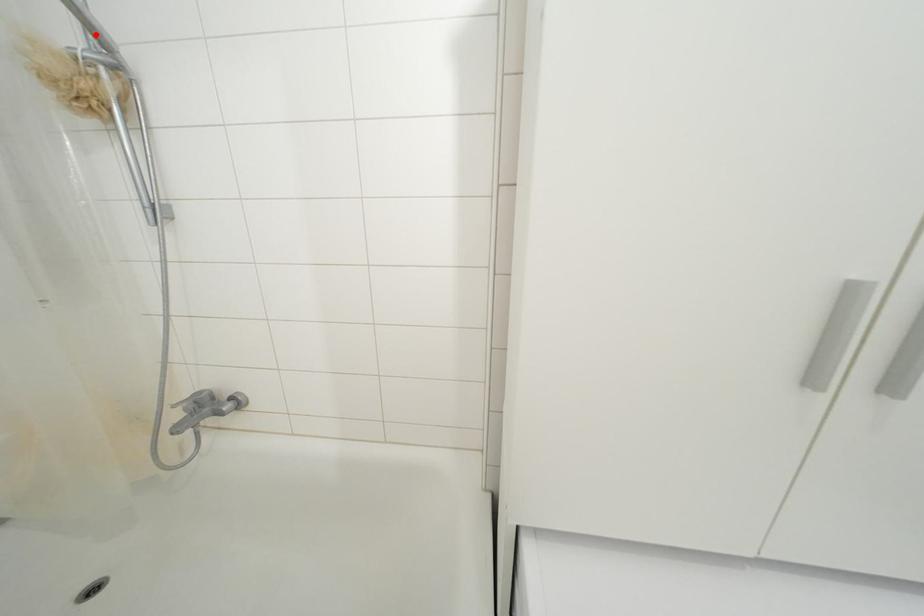
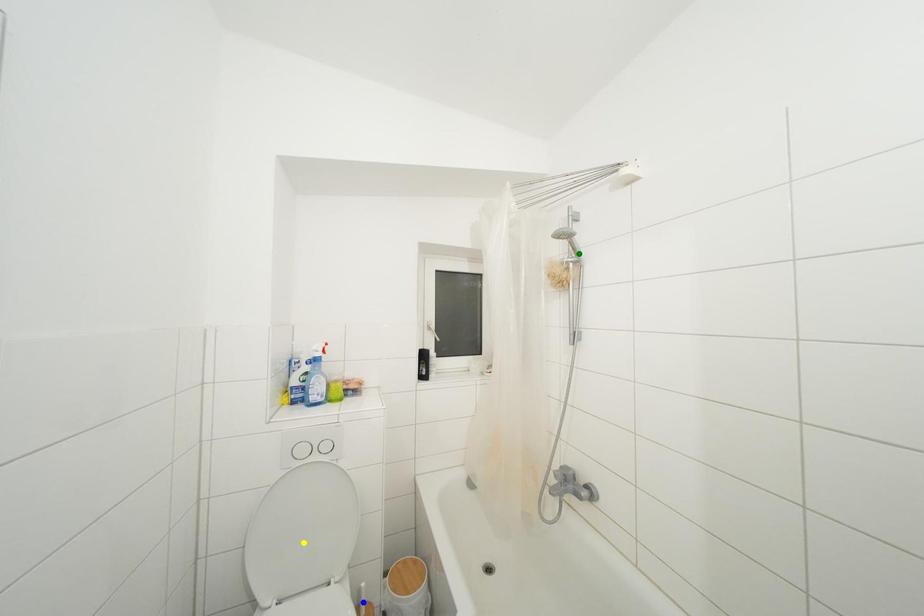
Question: I am providing you with two images of the same scene from different viewpoints. A red point is marked on the first image. You are given multiple points on the second image. Which spot in image 2 lines up with the point in image 1?

Choices:
 (A) green point
 (B) yellow point
 (C) blue point

Answer: (A)